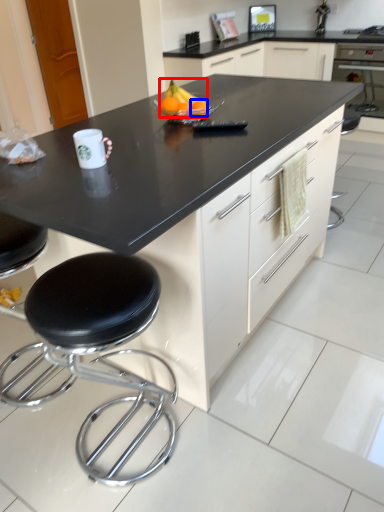
Question: Which point is further to the camera, fruit (highlighted by a red box) or orange (highlighted by a blue box)?

Choices:
 (A) fruit
 (B) orange

Answer: (A)